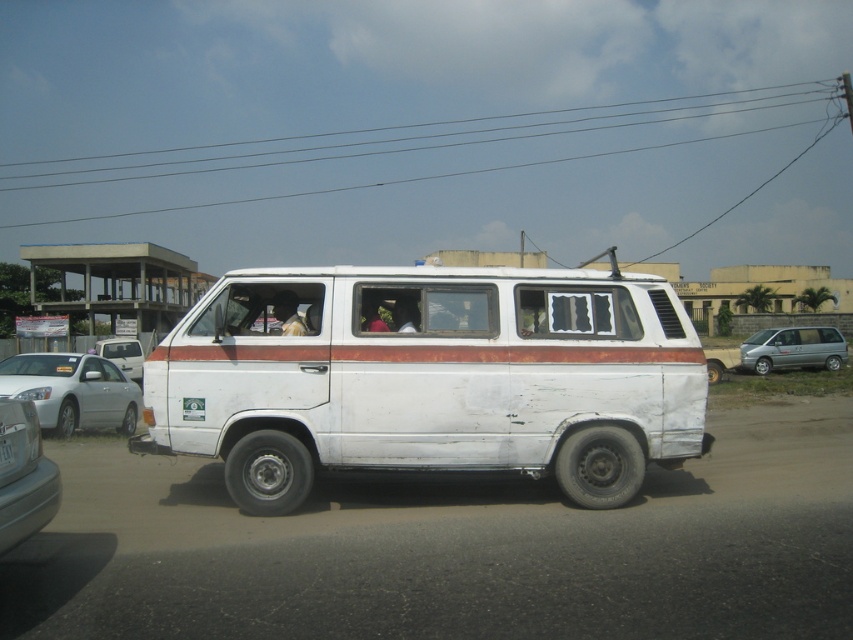
Between white matte van at center and metallic silver car at lower left, which one has more height?

With more height is white matte van at center.

Is white matte van at center closer to the viewer compared to metallic silver car at lower left?

No, white matte van at center is further to the viewer.

Between point (177, 323) and point (7, 513), which one is positioned in front?

Point (7, 513) is in front.

Find the location of a particular element. The image size is (853, 640). white matte van at center is located at coordinates [428, 378].

Is silver metallic sedan at left wider than metallic silver car at lower left?

Incorrect, silver metallic sedan at left's width does not surpass metallic silver car at lower left's.

Which is more to the left, silver metallic sedan at left or metallic silver car at lower left?

silver metallic sedan at left is more to the left.

Which is behind, point (18, 362) or point (6, 516)?

Point (18, 362)

You are a GUI agent. You are given a task and a screenshot of the screen. Output one action in this format:
    pyautogui.click(x=<x>, y=<y>)
    Task: Click on the silver metallic sedan at left
    Image resolution: width=853 pixels, height=640 pixels.
    Given the screenshot: What is the action you would take?
    pyautogui.click(x=73, y=392)

Can you confirm if silver metallic minivan at right is positioned to the right of white matte van at left?

Correct, you'll find silver metallic minivan at right to the right of white matte van at left.

Which of these two, silver metallic minivan at right or white matte van at left, stands taller?

silver metallic minivan at right is taller.

Where is `silver metallic minivan at right`? The image size is (853, 640). silver metallic minivan at right is located at coordinates pos(793,348).